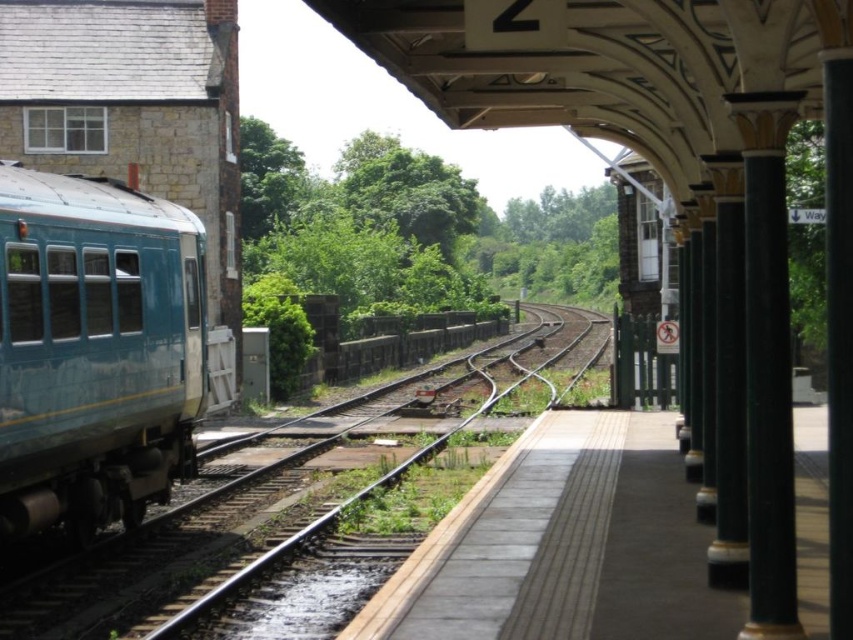
Based on the photo, who is taller, teal glossy train car at left or green polished stone column at right?

Standing taller between the two is teal glossy train car at left.

Who is more forward, (x=4, y=179) or (x=749, y=294)?

Point (x=749, y=294) is in front.

Where is `teal glossy train car at left`? The image size is (853, 640). teal glossy train car at left is located at coordinates (96, 349).

Does teal glossy train car at left appear under smooth concrete platform at center?

Actually, teal glossy train car at left is above smooth concrete platform at center.

Is teal glossy train car at left positioned behind smooth concrete platform at center?

Yes, it is behind smooth concrete platform at center.

Between point (189, 257) and point (381, 632), which one is positioned behind?

Point (189, 257)

Locate an element on the screen. This screenshot has width=853, height=640. teal glossy train car at left is located at coordinates (96, 349).

What do you see at coordinates (283, 490) in the screenshot?
I see `green metallic train track at center` at bounding box center [283, 490].

Looking at this image, does green metallic train track at center appear under green polished stone column at right?

Correct, green metallic train track at center is located below green polished stone column at right.

You are a GUI agent. You are given a task and a screenshot of the screen. Output one action in this format:
    pyautogui.click(x=<x>, y=<y>)
    Task: Click on the green metallic train track at center
    Image resolution: width=853 pixels, height=640 pixels.
    Given the screenshot: What is the action you would take?
    pyautogui.click(x=283, y=490)